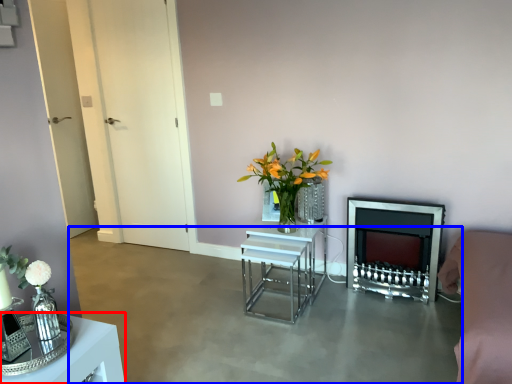
Question: Which of the following is the farthest to the observer, table (highlighted by a red box) or concrete (highlighted by a blue box)?

Choices:
 (A) table
 (B) concrete

Answer: (B)